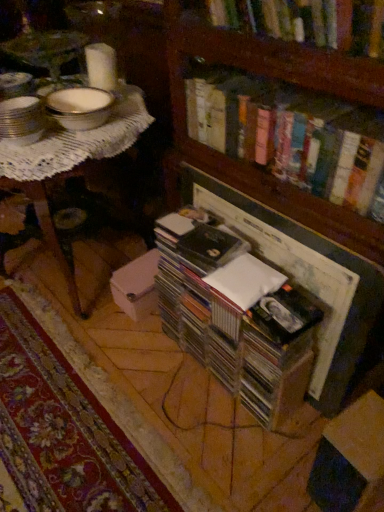
Question: From a real-world perspective, is hardcover books at upper center, marked as the 2th book in a bottom-to-top arrangement, above or below white lace table at upper left?

Choices:
 (A) above
 (B) below

Answer: (A)

Question: In terms of height, does hardcover books at upper center, marked as the 2th book in a bottom-to-top arrangement, look taller or shorter compared to white lace table at upper left?

Choices:
 (A) tall
 (B) short

Answer: (B)

Question: Which object is positioned farthest from the clear plastic case at center, which is the 1th book in bottom-to-top order?

Choices:
 (A) hardcover books at upper center, arranged as the 2th book when viewed from the top
 (B) cardboard box at lower right
 (C) white lace table at upper left
 (D) hardcover book at upper center, which ranks as the 3th book in bottom-to-top order
 (E) metallic silver bowls at upper left

Answer: (E)

Question: Estimate the real-world distances between objects in this image. Which object is closer to the hardcover books at upper center, arranged as the 2th book when viewed from the top?

Choices:
 (A) clear plastic case at center, which appears as the third book when viewed from the top
 (B) metallic silver bowls at upper left
 (C) cardboard box at lower right
 (D) wooden bookcase at center
 (E) white lace table at upper left

Answer: (D)